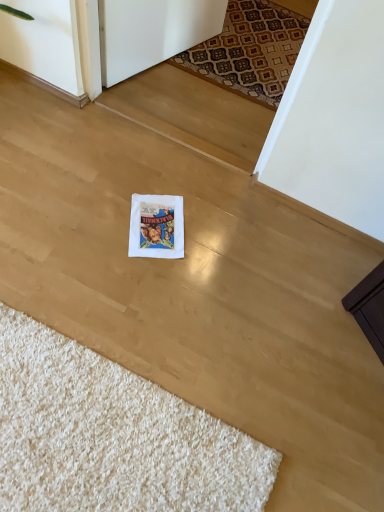
Identify the location of free spot above patterned carpet at upper center (from a real-world perspective). Image resolution: width=384 pixels, height=512 pixels. (261, 46).